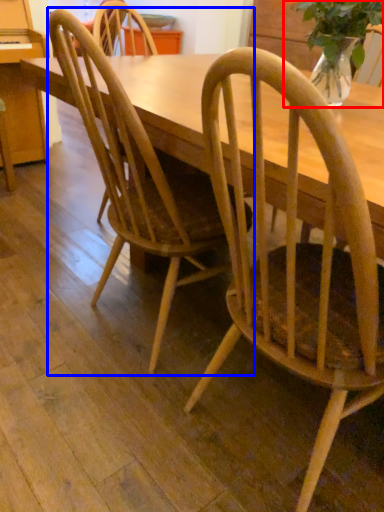
Question: Which object is closer to the camera taking this photo, houseplant (highlighted by a red box) or chair (highlighted by a blue box)?

Choices:
 (A) houseplant
 (B) chair

Answer: (B)